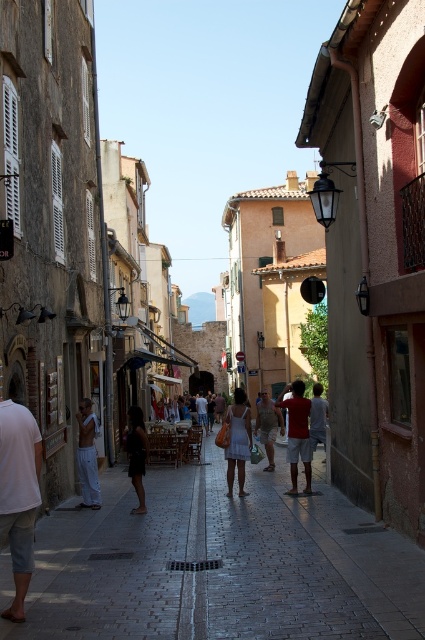
You are a photographer planning to take a photo of the street scene in the Mediterranean town. You want to ensure both the white dress at center and the khaki cotton shorts at center are clearly visible. Which clothing item should you focus on first to ensure it stands out in the composition?

The white dress at center is larger in size than the khaki cotton shorts at center, so focusing on the white dress at center first will ensure it stands out more in the composition.